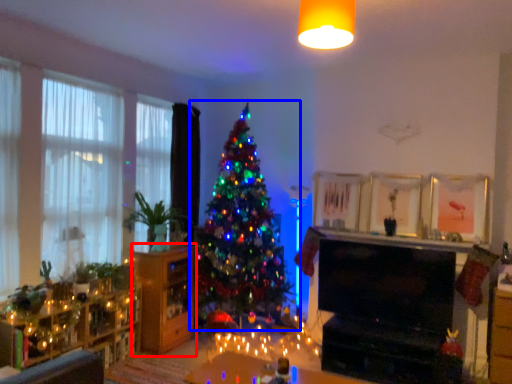
Question: Which object appears farthest to the camera in this image, dresser (highlighted by a red box) or christmas tree (highlighted by a blue box)?

Choices:
 (A) dresser
 (B) christmas tree

Answer: (A)